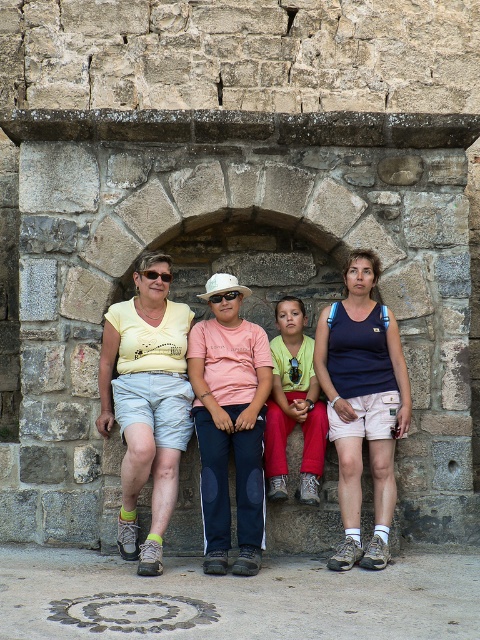
Question: In this image, where is navy blue tank top at center located relative to yellow-green t-shirt at center?

Choices:
 (A) right
 (B) left

Answer: (A)

Question: Which point is closer to the camera taking this photo?

Choices:
 (A) (350, 547)
 (B) (204, 392)
 (C) (224, 461)
 (D) (149, 276)

Answer: (A)

Question: Is navy blue tank top at center thinner than matte yellow goggles at center?

Choices:
 (A) yes
 (B) no

Answer: (B)

Question: Which point is farther from the camera taking this photo?

Choices:
 (A) (243, 570)
 (B) (212, 296)
 (C) (370, 268)

Answer: (C)

Question: Does light yellow cotton shirt at center have a smaller size compared to transparent plastic goggles at center?

Choices:
 (A) yes
 (B) no

Answer: (B)

Question: Among these points, which one is farthest from the camera?

Choices:
 (A) (159, 257)
 (B) (151, 278)
 (C) (220, 420)

Answer: (A)